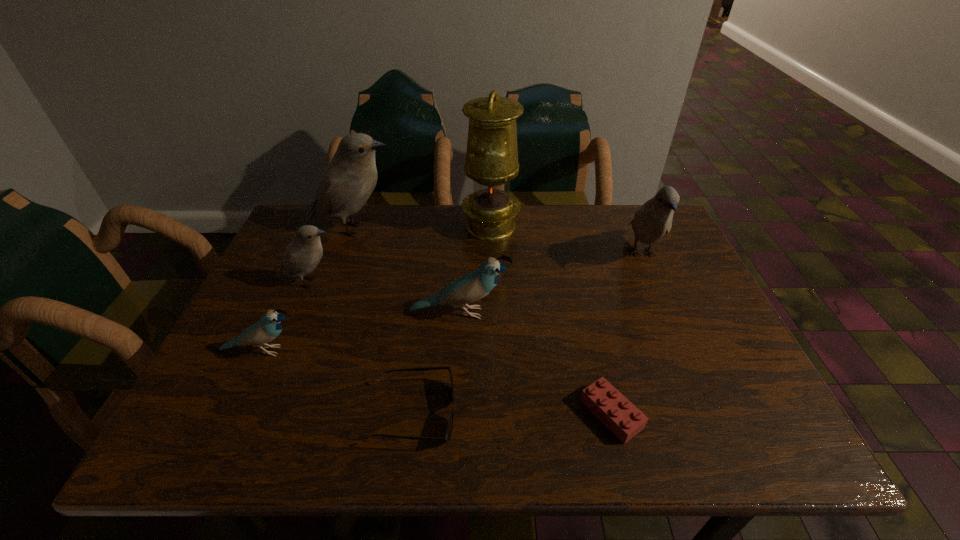
Where is `vacant space at the right edge`? The image size is (960, 540). vacant space at the right edge is located at coordinates (693, 355).

The height and width of the screenshot is (540, 960). Identify the location of free space at the far left corner of the desktop. (322, 228).

The width and height of the screenshot is (960, 540). Find the location of `vacant region between the sunglasses and the tallest object`. vacant region between the sunglasses and the tallest object is located at coordinates (452, 320).

This screenshot has height=540, width=960. Find the location of `empty space between the pink Lego and the smallest white bird`. empty space between the pink Lego and the smallest white bird is located at coordinates (461, 348).

The image size is (960, 540). What are the coordinates of `vacant space that is in between the smallest white bird and the biggest white bird` in the screenshot? It's located at (332, 256).

Where is `free space between the tallest bird and the tallest object`? This screenshot has width=960, height=540. free space between the tallest bird and the tallest object is located at coordinates (422, 228).

Find the location of a particular element. empty space that is in between the biggest white bird and the sunglasses is located at coordinates (384, 321).

Image resolution: width=960 pixels, height=540 pixels. Find the location of `free space between the sixth tallest object and the seventh shortest object`. free space between the sixth tallest object and the seventh shortest object is located at coordinates (308, 290).

Identify the location of blank region between the tallest object and the left blue bird. (376, 288).

The width and height of the screenshot is (960, 540). What are the coordinates of `vacant region between the shortest bird and the smallest white bird` in the screenshot? It's located at (286, 317).